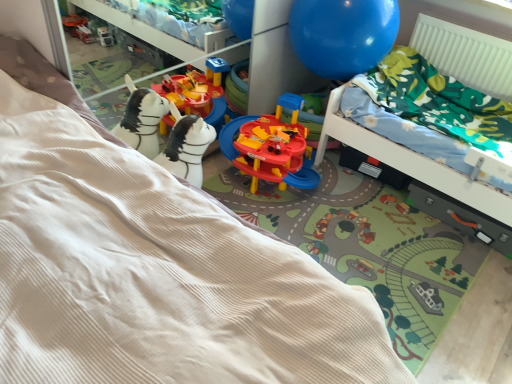
Question: Is blue glossy balloon at upper right shorter than green floral fabric hospital bed at upper right?

Choices:
 (A) yes
 (B) no

Answer: (A)

Question: Could you tell me if blue glossy balloon at upper right is facing green floral fabric hospital bed at upper right?

Choices:
 (A) no
 (B) yes

Answer: (A)

Question: Is blue glossy balloon at upper right bigger than green floral fabric hospital bed at upper right?

Choices:
 (A) no
 (B) yes

Answer: (A)

Question: Is blue glossy balloon at upper right further to the viewer compared to green floral fabric hospital bed at upper right?

Choices:
 (A) no
 (B) yes

Answer: (B)

Question: Is blue glossy balloon at upper right positioned beyond the bounds of green floral fabric hospital bed at upper right?

Choices:
 (A) yes
 (B) no

Answer: (A)

Question: Is blue glossy balloon at upper right beside green floral fabric hospital bed at upper right?

Choices:
 (A) no
 (B) yes

Answer: (A)

Question: Can you confirm if green floral fabric hospital bed at upper right is smaller than dark gray plastic drawer at lower right?

Choices:
 (A) yes
 (B) no

Answer: (B)

Question: Can we say green floral fabric hospital bed at upper right lies outside dark gray plastic drawer at lower right?

Choices:
 (A) yes
 (B) no

Answer: (A)

Question: Is green floral fabric hospital bed at upper right placed right next to dark gray plastic drawer at lower right?

Choices:
 (A) no
 (B) yes

Answer: (A)

Question: Does green floral fabric hospital bed at upper right appear on the right side of dark gray plastic drawer at lower right?

Choices:
 (A) no
 (B) yes

Answer: (B)

Question: Would you say green floral fabric hospital bed at upper right contains dark gray plastic drawer at lower right?

Choices:
 (A) yes
 (B) no

Answer: (A)

Question: Can you confirm if green floral fabric hospital bed at upper right is wider than dark gray plastic drawer at lower right?

Choices:
 (A) no
 (B) yes

Answer: (B)

Question: Considering the relative positions of white ribbed radiator at upper right and beige corduroy bed at lower left in the image provided, is white ribbed radiator at upper right to the left of beige corduroy bed at lower left from the viewer's perspective?

Choices:
 (A) no
 (B) yes

Answer: (A)